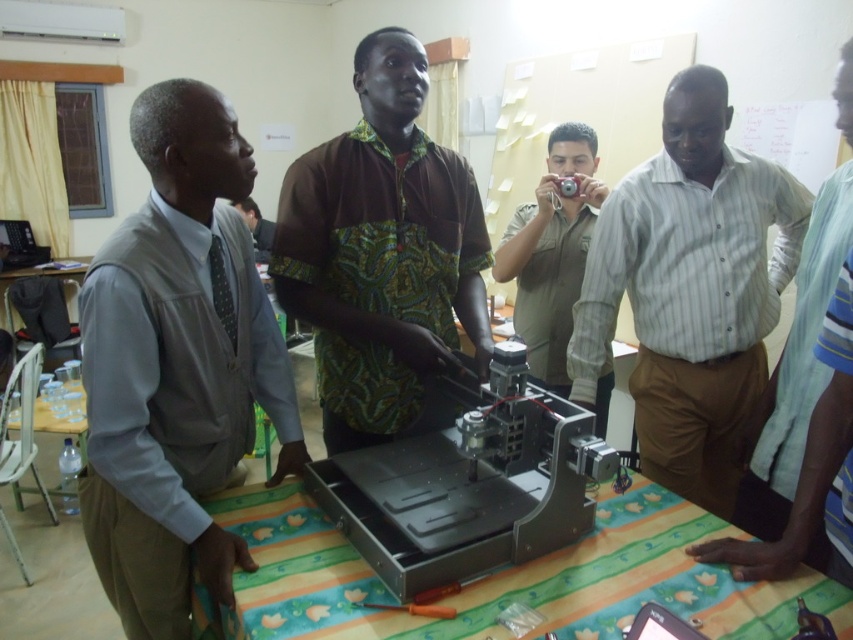
You are a student in the classroom looking at the metallic gray machine at center and the khaki uniform at center. Which object is positioned to the right side?

The khaki uniform at center is positioned to the right of the metallic gray machine at center.

You are standing at the entrance of the classroom and want to see the metallic gray machine at center clearly. Is the striped cotton shirt at center blocking your view of it?

The metallic gray machine at center is behind the striped cotton shirt at center, so the striped cotton shirt at center is blocking your view of the metallic gray machine at center.